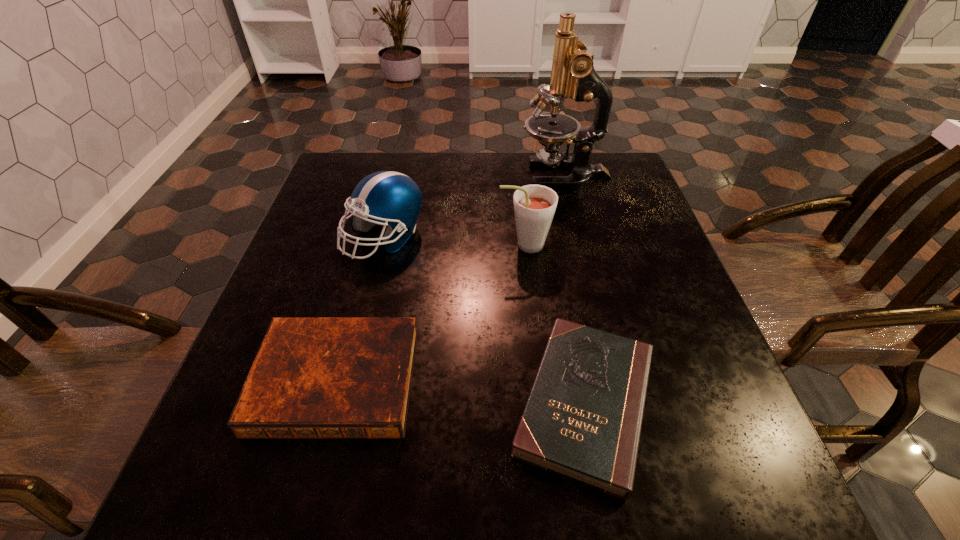
What are the coordinates of `free space between the left Bible and the root beer` in the screenshot? It's located at (430, 313).

Identify the location of empty location between the right Bible and the microscope. This screenshot has width=960, height=540. (575, 289).

Identify the location of free spot between the right Bible and the farthest object. This screenshot has width=960, height=540. tap(575, 289).

The image size is (960, 540). I want to click on free space that is in between the football helmet and the left Bible, so click(360, 309).

Locate an element on the screen. The width and height of the screenshot is (960, 540). vacant area that lies between the left Bible and the tallest object is located at coordinates (450, 278).

Locate which object ranks second in proximity to the root beer. Please provide its 2D coordinates. Your answer should be formatted as a tuple, i.e. [(x, y)], where the tuple contains the x and y coordinates of a point satisfying the conditions above.

[(393, 198)]

Image resolution: width=960 pixels, height=540 pixels. Identify the location of the fourth closest object to the farthest object. (312, 377).

Find the location of a particular element. This screenshot has height=540, width=960. vacant region that satisfies the following two spatial constraints: 1. on the drink side of the right Bible; 2. on the right side of the root beer is located at coordinates (541, 403).

Identify the location of vacant space that satisfies the following two spatial constraints: 1. on the drink side of the root beer; 2. on the back side of the right Bible. (541, 403).

Locate an element on the screen. The image size is (960, 540). free space that satisfies the following two spatial constraints: 1. on the spine side of the left Bible; 2. on the left side of the right Bible is located at coordinates (330, 403).